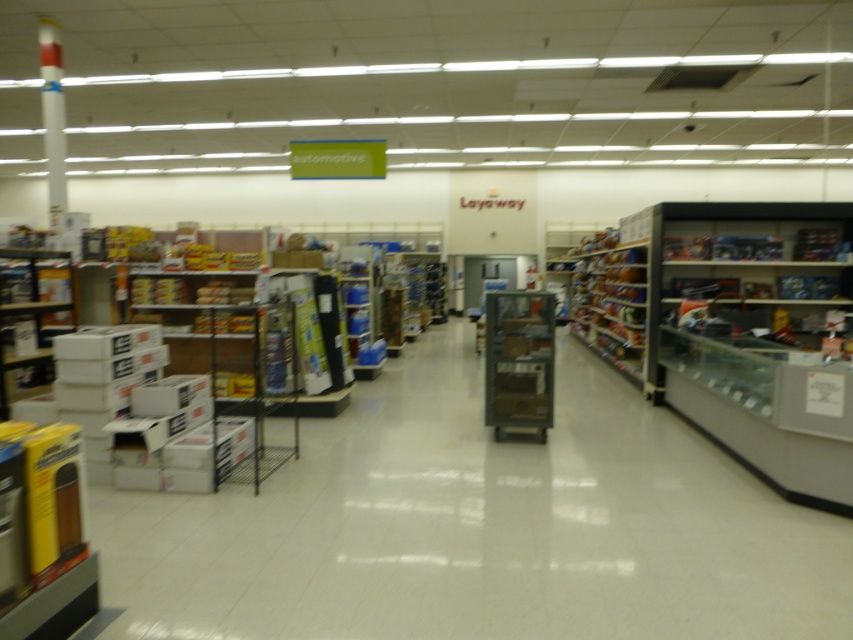
You are standing at the entrance of the retail store and want to locate the metallic silver shelf at center. According to the store layout, where would you find it?

The metallic silver shelf at center is located at the 2D coordinates point (518,360) in the store layout.